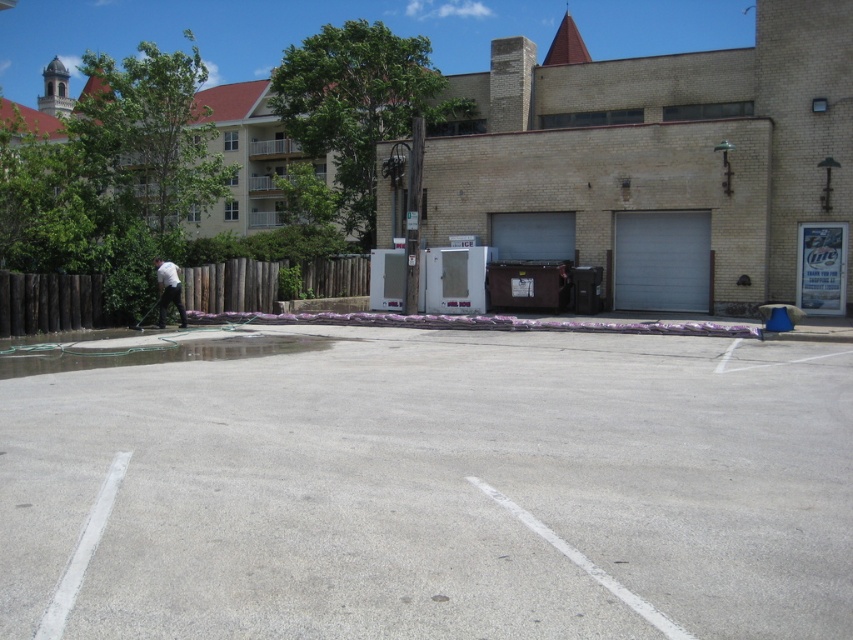
Which is more to the right, brown wooden fence at left or clear concrete puddle at lower left?

clear concrete puddle at lower left

At what (x,y) coordinates should I click in order to perform the action: click on brown wooden fence at left. Please return your answer as a coordinate pair (x, y). This screenshot has width=853, height=640. Looking at the image, I should click on pyautogui.click(x=270, y=282).

Does point (289, 260) lie in front of point (223, 353)?

That is False.

Find the location of `brown wooden fence at left`. brown wooden fence at left is located at coordinates (270, 282).

In the scene shown: Who is positioned more to the left, gray concrete parking lot at center or brown wooden fence at left?

From the viewer's perspective, brown wooden fence at left appears more on the left side.

Is point (439, 481) in front of point (260, 282)?

Yes.

Who is more distant from viewer, (630,362) or (209,262)?

Point (209,262)

The image size is (853, 640). Find the location of `gray concrete parking lot at center`. gray concrete parking lot at center is located at coordinates (426, 484).

Does brown wooden fence at left appear on the right side of white matte shirt at left?

Yes, brown wooden fence at left is to the right of white matte shirt at left.

Does brown wooden fence at left appear under white matte shirt at left?

Actually, brown wooden fence at left is above white matte shirt at left.

Between point (297, 296) and point (165, 269), which one is positioned in front?

Point (165, 269) is in front.

Where is `brown wooden fence at left`? The width and height of the screenshot is (853, 640). brown wooden fence at left is located at coordinates (270, 282).